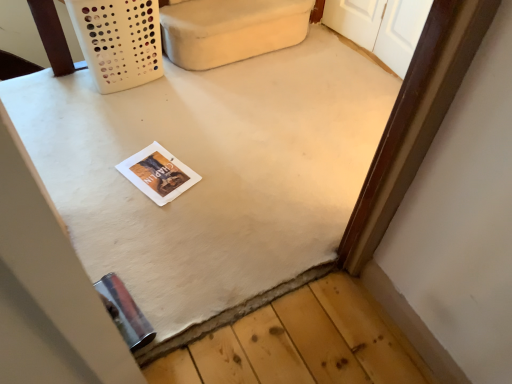
Where is `empty space that is ontop of white paper magazine at center`? This screenshot has height=384, width=512. empty space that is ontop of white paper magazine at center is located at coordinates (152, 168).